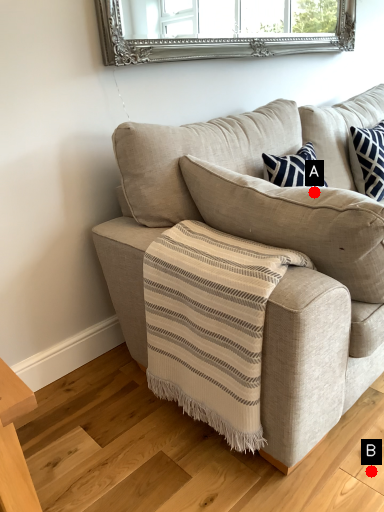
Question: Two points are circled on the image, labeled by A and B beside each circle. Which point is closer to the camera?

Choices:
 (A) A is closer
 (B) B is closer

Answer: (A)